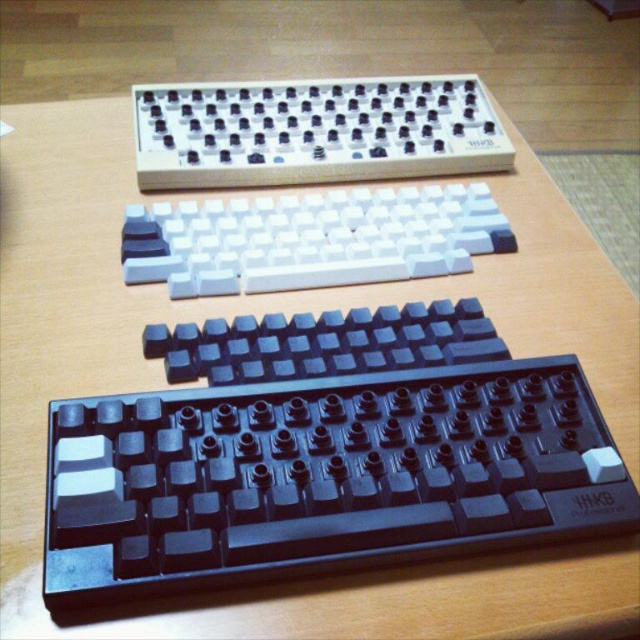
You are organizing keyboards on a desk and want to place a new keyboard between the white matte keyboard at upper center and the white matte keyboard at center. Which position should the new keyboard be placed to maintain the existing vertical arrangement?

The new keyboard should be placed between the white matte keyboard at upper center and the white matte keyboard at center, closer to the white matte keyboard at center since the upper one is closer to the viewer and the middle one is further back, maintaining the vertical arrangement.

You are organizing a display of keyboards on a desk and need to ensure proper spacing between them. The white matte keyboard at upper center and the white matte keyboard at center are part of this display. Based on their positions, which keyboard is positioned higher up on the desk?

The white matte keyboard at upper center is positioned higher up on the desk than the white matte keyboard at center.

You are standing in front of the three mechanical keyboards arranged vertically on the desk. There are two points marked on the desk surface at coordinates point (84, 454) and point (221, 291). If you want to place a small object on the desk between these two points, which point should you place it closer to so that it is closer to the front of the desk?

You should place the object closer to point (84, 454) because it is in front of point (221, 291).